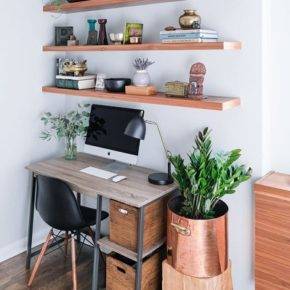
In order to click on book in this screenshot , I will do `click(174, 35)`.